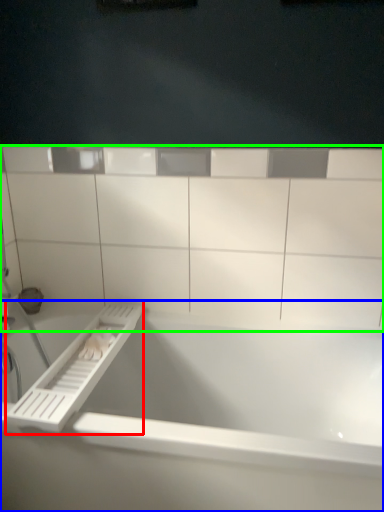
Question: Considering the real-world distances, which object is closest to towel bar (highlighted by a red box)? bathtub (highlighted by a blue box) or ledge (highlighted by a green box).

Choices:
 (A) bathtub
 (B) ledge

Answer: (A)